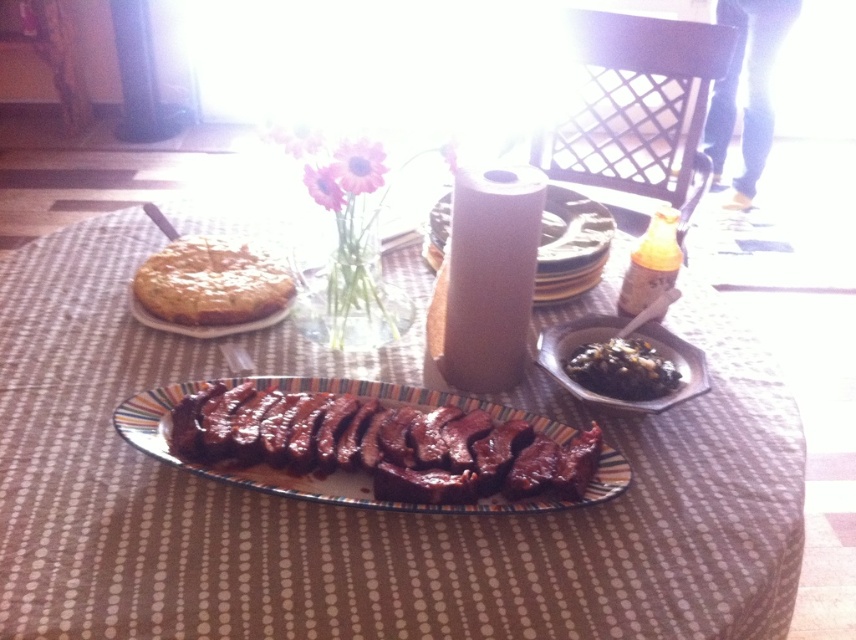
Question: Which point is farther from the camera taking this photo?

Choices:
 (A) pyautogui.click(x=324, y=593)
 (B) pyautogui.click(x=167, y=296)

Answer: (B)

Question: Which object appears farthest from the camera in this image?

Choices:
 (A) glossy ceramic platter at center
 (B) yellow cake at upper left
 (C) black glossy bowl at center
 (D) golden brown flaky pastry at upper left

Answer: (D)

Question: Is smokey brown meat at center smaller than glossy ceramic platter at center?

Choices:
 (A) yes
 (B) no

Answer: (B)

Question: Can you confirm if smokey brown meat at center is thinner than yellow cake at upper left?

Choices:
 (A) no
 (B) yes

Answer: (A)

Question: Considering the real-world distances, which object is farthest from the smokey brown meat at center?

Choices:
 (A) yellow cake at upper left
 (B) black glossy bowl at center
 (C) glossy ceramic platter at center
 (D) golden brown flaky pastry at upper left

Answer: (A)

Question: Does black glossy sauce at center have a lesser width compared to yellow cake at upper left?

Choices:
 (A) no
 (B) yes

Answer: (B)